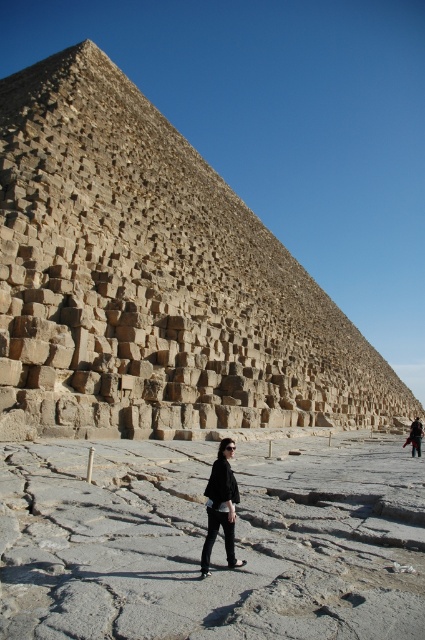
How far apart are black matte jacket at center and dark brown leather jacket at lower right?

A distance of 46.41 meters exists between black matte jacket at center and dark brown leather jacket at lower right.

Does black matte jacket at center have a larger size compared to dark brown leather jacket at lower right?

No.

Does point (229, 468) come closer to viewer compared to point (411, 452)?

Yes, it is.

Where is `black matte jacket at center`? Image resolution: width=425 pixels, height=640 pixels. black matte jacket at center is located at coordinates tap(221, 506).

This screenshot has width=425, height=640. Identify the location of brown stone pyramid at center. pyautogui.click(x=153, y=280).

Does point (17, 243) come behind point (416, 445)?

No, (17, 243) is closer to viewer.

Identify the location of brown stone pyramid at center. The height and width of the screenshot is (640, 425). (153, 280).

Which is in front, point (110, 360) or point (207, 492)?

Point (207, 492) is in front.

Does point (34, 273) come in front of point (229, 512)?

That is False.

I want to click on brown stone pyramid at center, so click(153, 280).